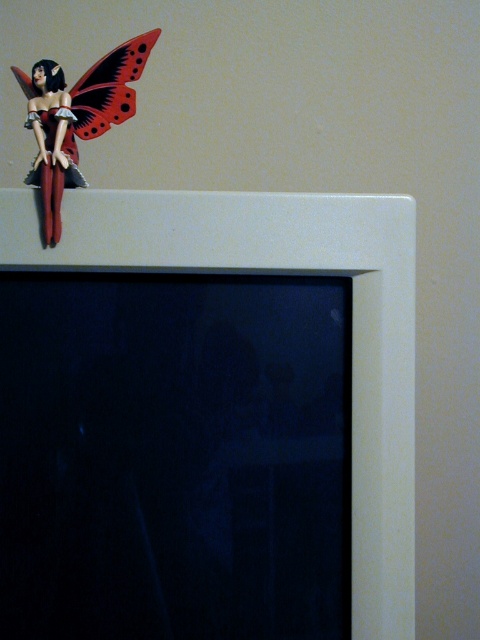
Measure the distance between matte black fairy at upper left and matte plastic butterfly at upper left.

matte black fairy at upper left and matte plastic butterfly at upper left are 1.46 inches apart.

What do you see at coordinates (51, 144) in the screenshot?
I see `matte black fairy at upper left` at bounding box center [51, 144].

This screenshot has height=640, width=480. In order to click on matte black fairy at upper left in this screenshot , I will do `click(51, 144)`.